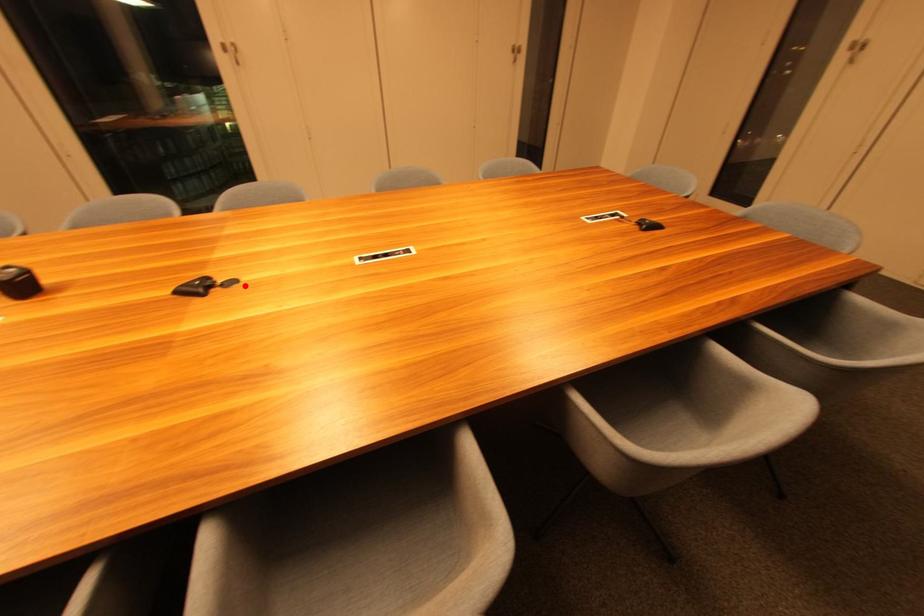
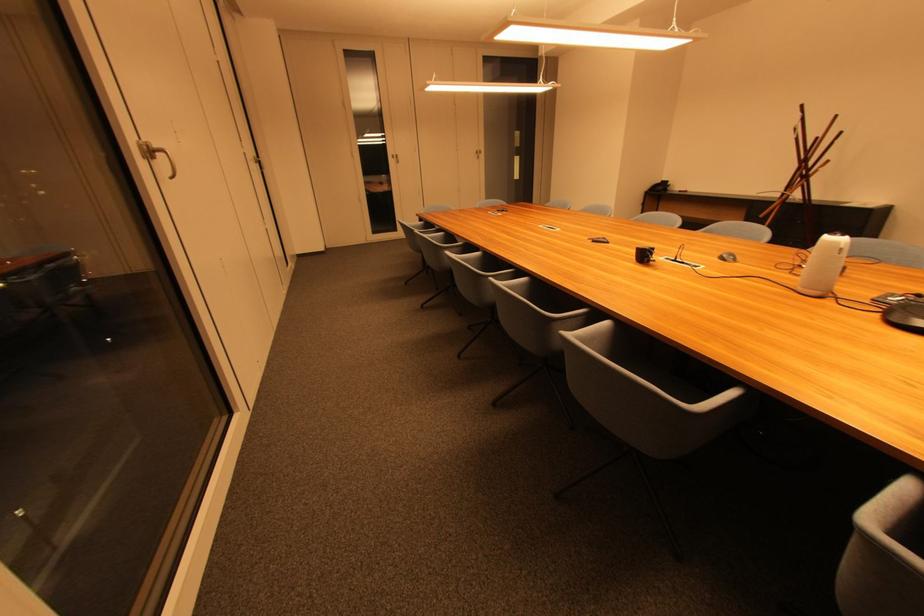
In the second image, find the point that corresponds to the highlighted location in the first image.

(596, 240)